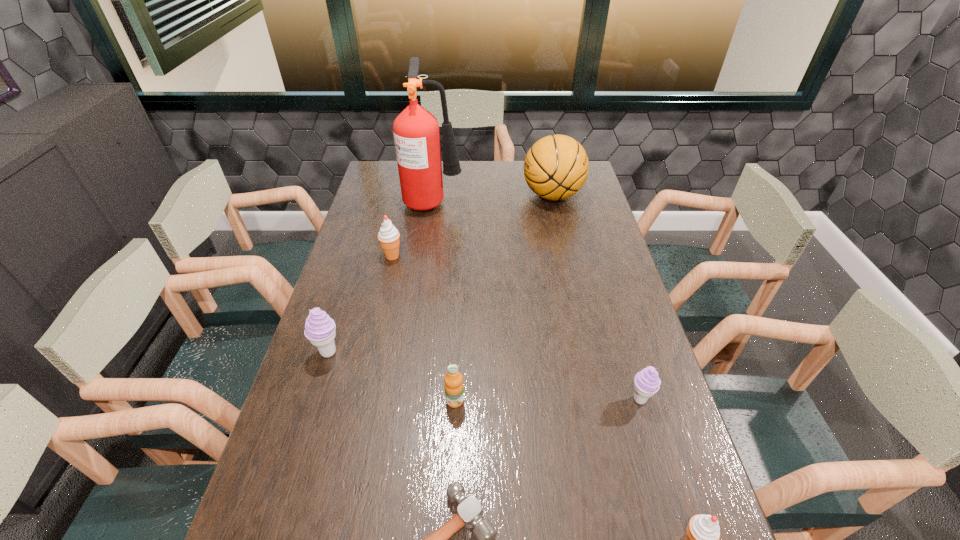
At what (x,y) coordinates should I click in order to perform the action: click on basketball at the far edge. Please return your answer as a coordinate pair (x, y). This screenshot has width=960, height=540. Looking at the image, I should click on (556, 167).

Locate an element on the screen. Image resolution: width=960 pixels, height=540 pixels. basketball located in the right edge section of the desktop is located at coordinates (556, 167).

Identify the location of icecream present at the right edge. (646, 383).

At what (x,y) coordinates should I click in order to perform the action: click on object present at the far right corner. Please return your answer as a coordinate pair (x, y). This screenshot has height=540, width=960. Looking at the image, I should click on (556, 167).

What are the coordinates of `vacant space at the far edge of the desktop` in the screenshot? It's located at (518, 183).

The image size is (960, 540). I want to click on vacant region at the left edge of the desktop, so click(x=360, y=379).

This screenshot has width=960, height=540. In the image, there is a desktop. What are the coordinates of `vacant space at the right edge` in the screenshot? It's located at (643, 480).

Image resolution: width=960 pixels, height=540 pixels. What are the coordinates of `vacant space at the far left corner of the desktop` in the screenshot? It's located at (377, 177).

Find the location of a particular element. This screenshot has height=540, width=960. vacant point located between the fifth nearest object and the second icecream from left to right is located at coordinates (361, 303).

This screenshot has width=960, height=540. In order to click on free spot between the fourth farthest object and the farther red icecream in this screenshot , I will do `click(361, 303)`.